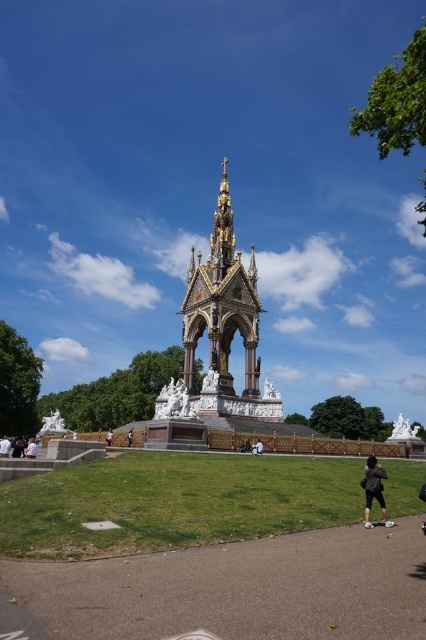
Question: Which object is closer to the camera taking this photo?

Choices:
 (A) black fabric bag at center
 (B) green grass at center

Answer: (B)

Question: Does white marble statue at center appear under white fabric person at center?

Choices:
 (A) no
 (B) yes

Answer: (B)

Question: Considering the real-world distances, which object is closest to the brown asphalt path at lower center?

Choices:
 (A) white fabric person at center
 (B) white marble statue at lower left

Answer: (A)

Question: Considering the real-world distances, which object is closest to the white marble statue at lower left?

Choices:
 (A) gold/gilded stone monument at center
 (B) black fabric bag at center

Answer: (A)

Question: Is brown asphalt path at lower center bigger than green grass at center?

Choices:
 (A) no
 (B) yes

Answer: (A)

Question: Does brown asphalt path at lower center lie behind gold/gilded stone monument at center?

Choices:
 (A) no
 (B) yes

Answer: (A)